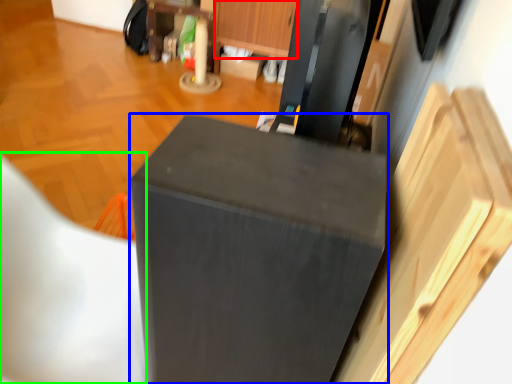
Question: Estimate the real-world distances between objects in this image. Which object is farther from drawer (highlighted by a red box), furniture (highlighted by a blue box) or folding chair (highlighted by a green box)?

Choices:
 (A) furniture
 (B) folding chair

Answer: (A)